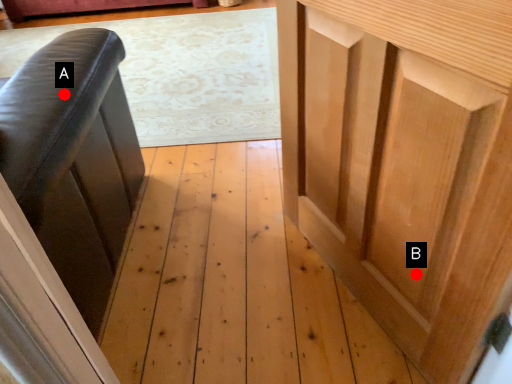
Question: Two points are circled on the image, labeled by A and B beside each circle. Among these points, which one is farthest from the camera?

Choices:
 (A) A is further
 (B) B is further

Answer: (A)